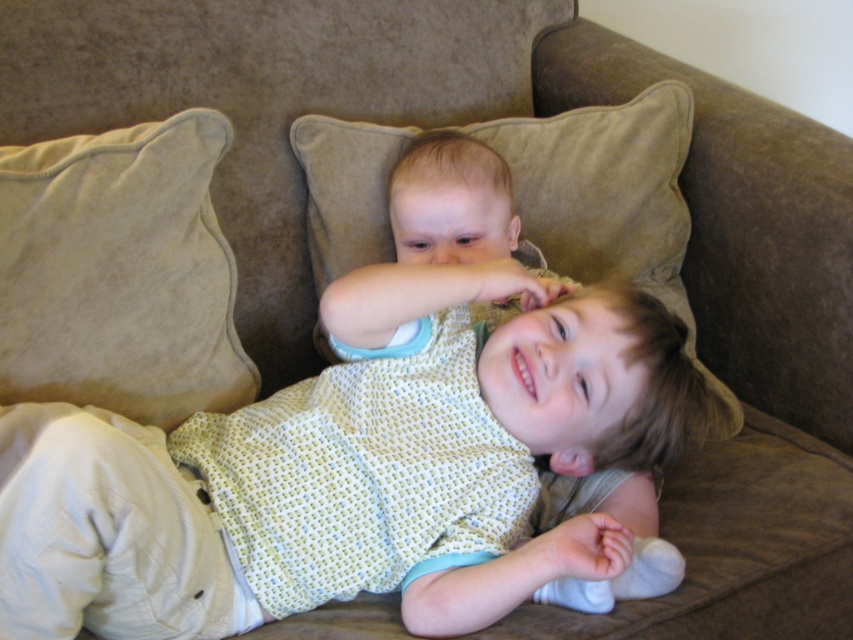
Is light yellow knitted sweater at center shorter than beige suede pillow at center?

Yes, light yellow knitted sweater at center is shorter than beige suede pillow at center.

Which is in front, point (64, 625) or point (642, 259)?

Point (64, 625) is more forward.

Locate an element on the screen. The height and width of the screenshot is (640, 853). light yellow knitted sweater at center is located at coordinates (347, 481).

Is light yellow knitted sweater at center shorter than beige suede pillow at left?

Correct, light yellow knitted sweater at center is not as tall as beige suede pillow at left.

Locate an element on the screen. The image size is (853, 640). light yellow knitted sweater at center is located at coordinates (347, 481).

Who is positioned more to the right, beige suede pillow at left or beige suede pillow at center?

beige suede pillow at center

Find the location of a particular element. The width and height of the screenshot is (853, 640). beige suede pillow at left is located at coordinates (120, 273).